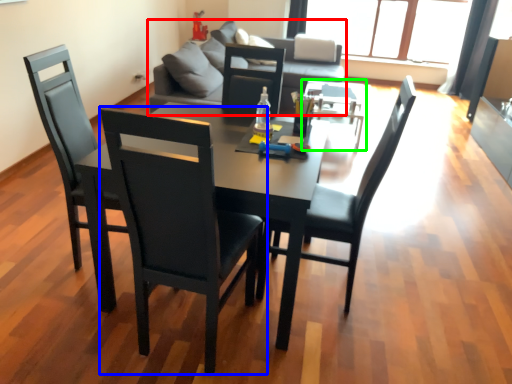
Question: Considering the real-world distances, which object is farthest from studio couch (highlighted by a red box)? chair (highlighted by a blue box) or coffee table (highlighted by a green box)?

Choices:
 (A) chair
 (B) coffee table

Answer: (A)